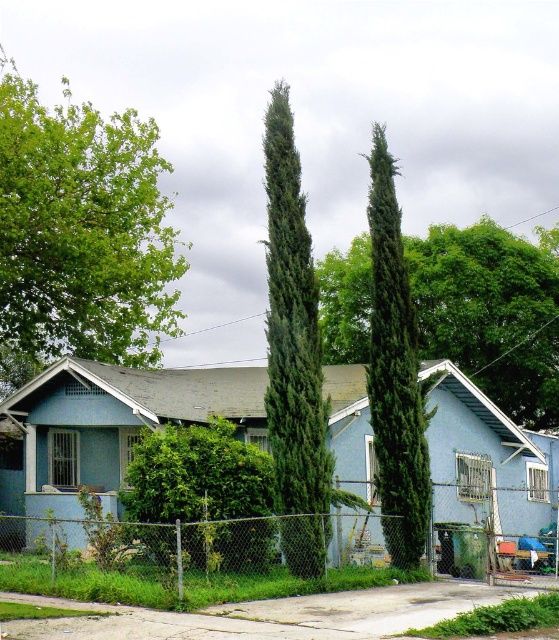
Is chain-link fence at center positioned before green textured tree at center?

Yes, it is in front of green textured tree at center.

From the picture: Which is below, chain-link fence at center or green textured tree at center?

chain-link fence at center is below.

Where is `chain-link fence at center`? chain-link fence at center is located at coordinates (186, 560).

Does green textured tree at center appear under green textured cypress at center?

Correct, green textured tree at center is located below green textured cypress at center.

Can you confirm if green textured tree at center is thinner than green textured cypress at center?

No, green textured tree at center is not thinner than green textured cypress at center.

What do you see at coordinates (491, 312) in the screenshot?
I see `green textured tree at center` at bounding box center [491, 312].

Where is `green textured tree at center`? This screenshot has width=559, height=640. green textured tree at center is located at coordinates (491, 312).

Measure the distance from green leafy tree at upper left to green textured cypress at center.

A distance of 58.51 feet exists between green leafy tree at upper left and green textured cypress at center.

Which is in front, point (30, 349) or point (269, 294)?

Positioned in front is point (269, 294).

Image resolution: width=559 pixels, height=640 pixels. What are the coordinates of `green leafy tree at upper left` in the screenshot? It's located at (80, 234).